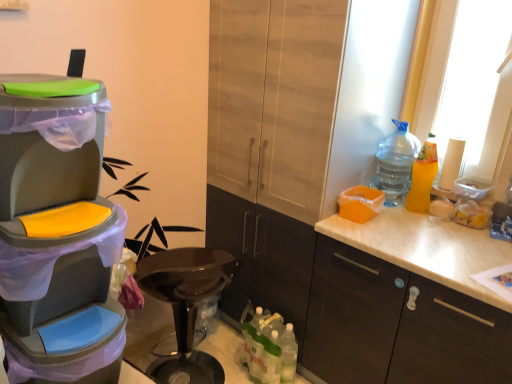
Identify the location of vacant area to the left of yellow matte bottle at right, which is the 1th bottle in right-to-left order. This screenshot has height=384, width=512. [395, 214].